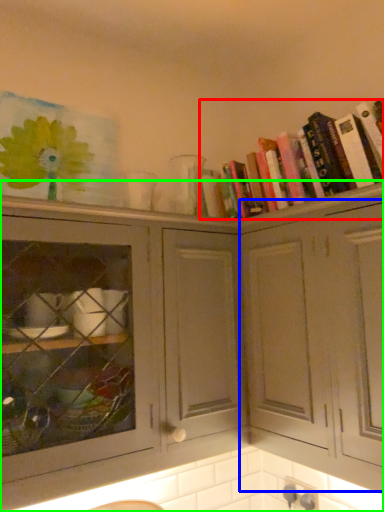
Question: Based on their relative distances, which object is farther from book (highlighted by a red box)? Choose from cabinetry (highlighted by a blue box) and cabinetry (highlighted by a green box).

Choices:
 (A) cabinetry
 (B) cabinetry

Answer: (B)